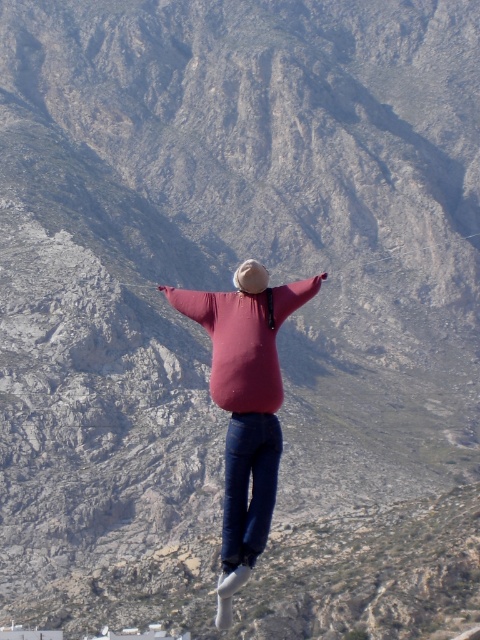
You are a photographer trying to capture the perfect shot of the person in the scene. Since the person is wearing a matte pink sweater at center and blue denim jeans at center, which clothing item would appear more prominent in the photo due to its size?

The matte pink sweater at center would appear more prominent in the photo because it is larger in size than the blue denim jeans at center.